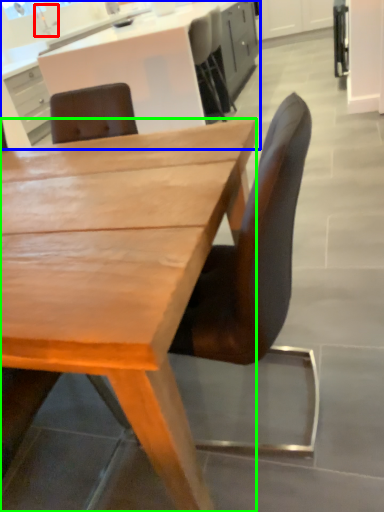
Question: Which object is the farthest from faucet (highlighted by a red box)? Choose among these: cabinetry (highlighted by a blue box) or desk (highlighted by a green box).

Choices:
 (A) cabinetry
 (B) desk

Answer: (B)